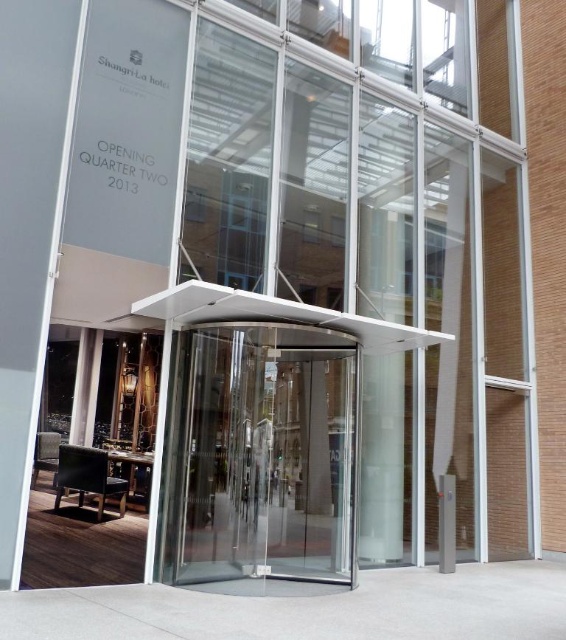
Can you confirm if transparent glass door at center is positioned to the right of smooth concrete pillar at center?

Incorrect, transparent glass door at center is not on the right side of smooth concrete pillar at center.

Where is `transparent glass door at center`? Image resolution: width=566 pixels, height=640 pixels. transparent glass door at center is located at coordinates (259, 458).